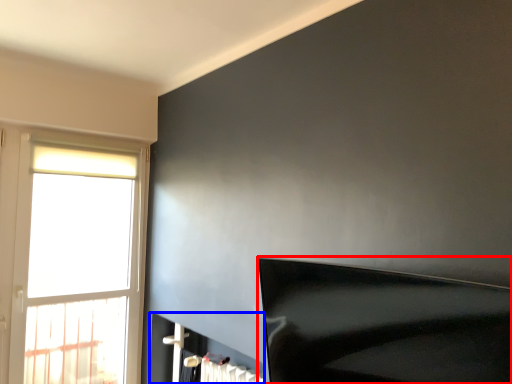
Question: Which object appears closest to the camera in this image, furniture (highlighted by a red box) or fireplace (highlighted by a blue box)?

Choices:
 (A) furniture
 (B) fireplace

Answer: (A)